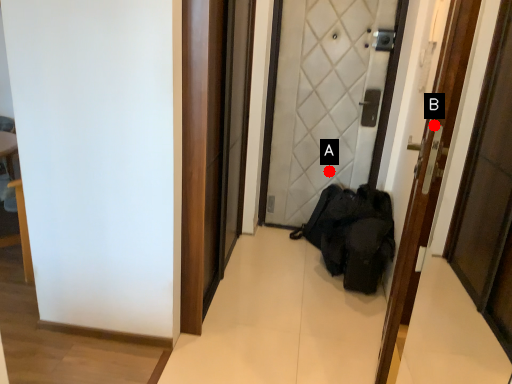
Question: Two points are circled on the image, labeled by A and B beside each circle. Which point is farther from the camera taking this photo?

Choices:
 (A) A is further
 (B) B is further

Answer: (A)